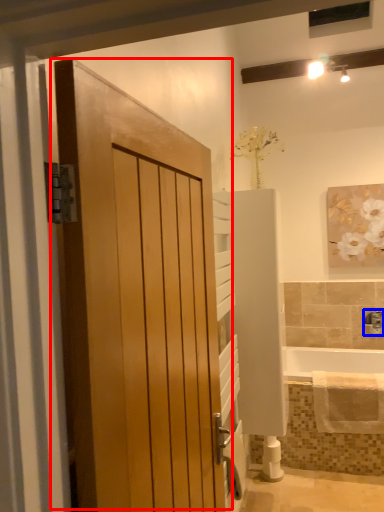
Question: Which object appears closest to the camera in this image, door (highlighted by a red box) or tap (highlighted by a blue box)?

Choices:
 (A) door
 (B) tap

Answer: (A)